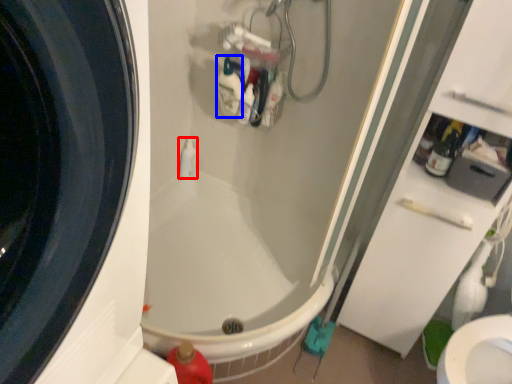
Question: Which point is closer to the camera, toiletry (highlighted by a red box) or cleaning product (highlighted by a blue box)?

Choices:
 (A) toiletry
 (B) cleaning product

Answer: (B)